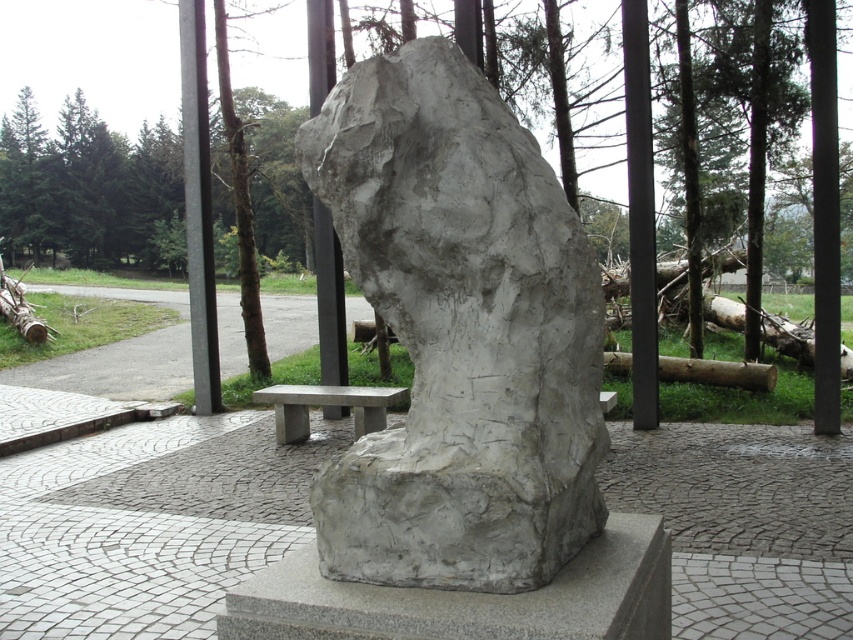
Which is behind, point (337, 560) or point (297, 436)?

The point (297, 436) is behind.

Does white stone sculpture at center appear under smooth concrete bench at center?

Actually, white stone sculpture at center is above smooth concrete bench at center.

Which is behind, point (466, 493) or point (381, 392)?

Point (381, 392)

Find the location of a particular element. white stone sculpture at center is located at coordinates (459, 333).

Can you confirm if gray granite cement at center is thinner than smooth concrete bench at center?

Yes, gray granite cement at center is thinner than smooth concrete bench at center.

Between gray granite cement at center and smooth concrete bench at center, which one has less height?

gray granite cement at center is shorter.

Between point (552, 630) and point (349, 397), which one is positioned in front?

Positioned in front is point (552, 630).

At what (x,y) coordinates should I click in order to perform the action: click on gray granite cement at center. Please return your answer as a coordinate pair (x, y). Image resolution: width=853 pixels, height=640 pixels. Looking at the image, I should click on (469, 598).

Is white stone sculpture at center further to the viewer compared to gray granite cement at center?

Yes, white stone sculpture at center is further from the viewer.

Is point (566, 221) closer to camera compared to point (663, 577)?

Yes.

Where is `white stone sculpture at center`? The width and height of the screenshot is (853, 640). white stone sculpture at center is located at coordinates (459, 333).